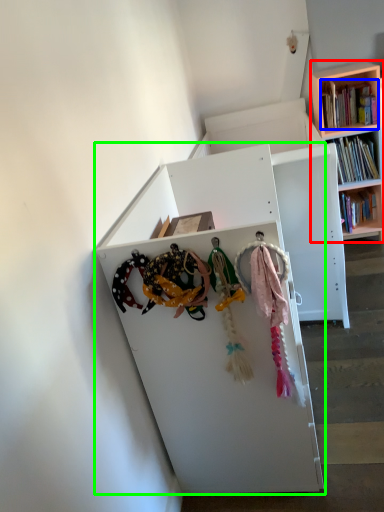
Question: Which is farther away from bookcase (highlighted by a red box)? book (highlighted by a blue box) or shelf (highlighted by a green box)?

Choices:
 (A) book
 (B) shelf

Answer: (B)